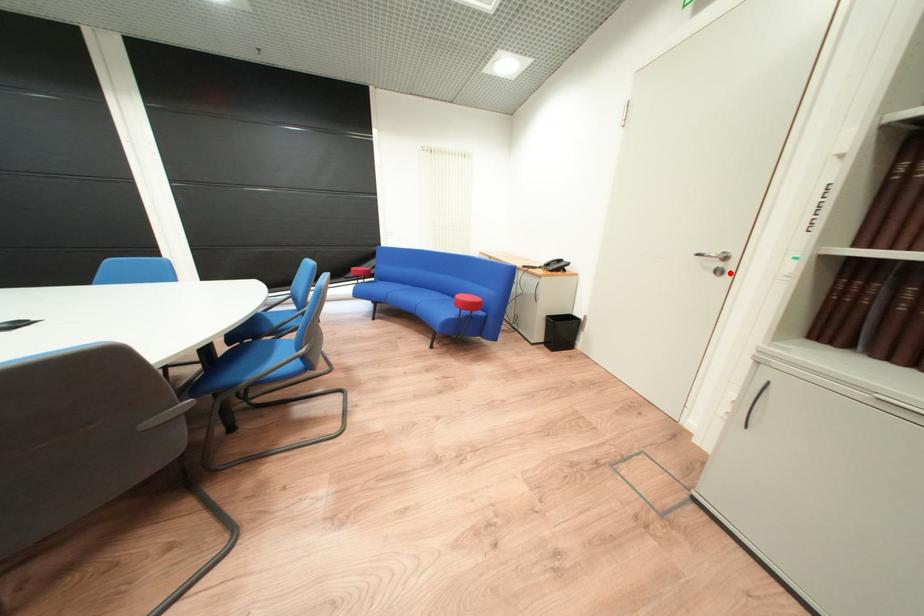
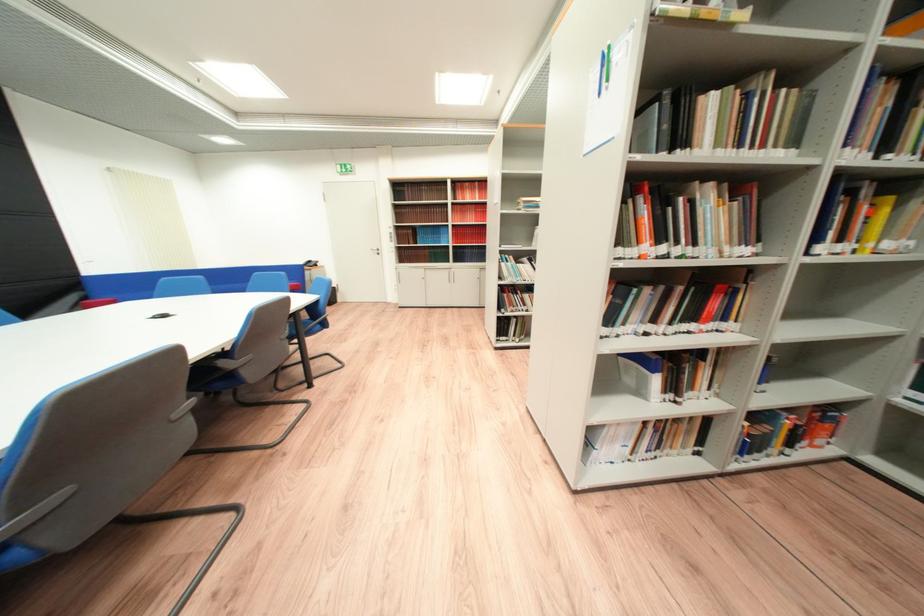
Question: I am providing you with two images of the same scene from different viewpoints. Image1 has a red point marked. In image2, the corresponding 3D location appears at what relative position? Reply with the corresponding letter.

Choices:
 (A) Closer
 (B) Farther

Answer: (A)